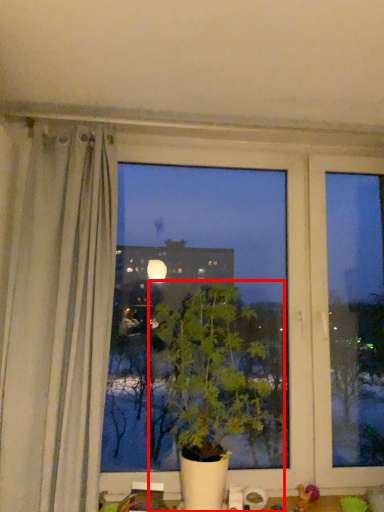
Question: From the image's perspective, what is the correct spatial relationship of houseplant (annotated by the red box) in relation to toy?

Choices:
 (A) below
 (B) above

Answer: (B)